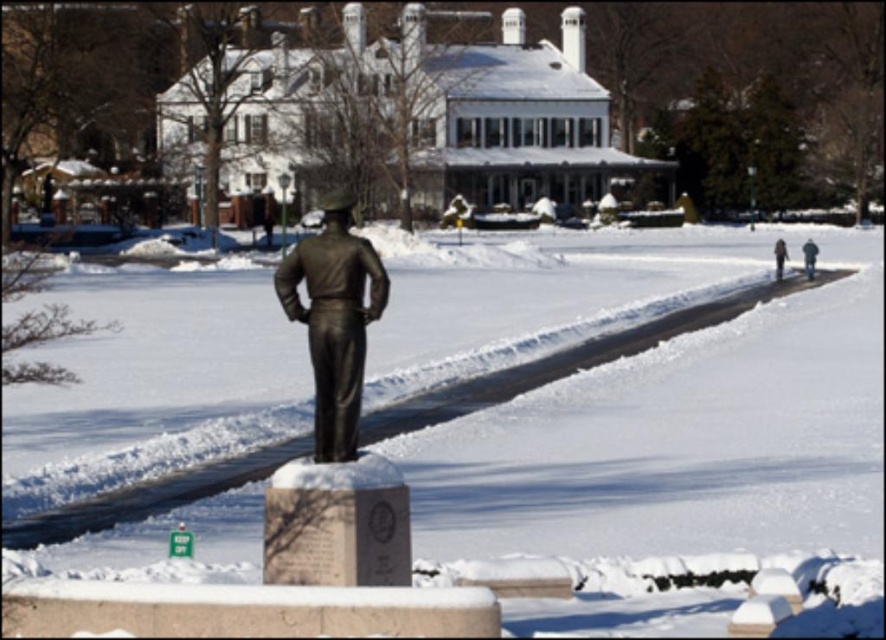
Question: Does dark gray uniform at right appear over dark brown leather jacket at right?

Choices:
 (A) no
 (B) yes

Answer: (B)

Question: Can you confirm if bronze statue at center is smaller than dark gray uniform at right?

Choices:
 (A) yes
 (B) no

Answer: (A)

Question: Which is nearer to the dark brown leather jacket at right?

Choices:
 (A) dark gray uniform at right
 (B) bronze statue at center

Answer: (A)

Question: Is dark gray uniform at right below dark brown leather jacket at right?

Choices:
 (A) no
 (B) yes

Answer: (A)

Question: Which point appears closest to the camera in this image?

Choices:
 (A) (291, 298)
 (B) (804, 260)
 (C) (783, 260)

Answer: (A)

Question: Which of the following is the farthest from the observer?

Choices:
 (A) (319, 390)
 (B) (778, 272)
 (C) (810, 273)

Answer: (C)